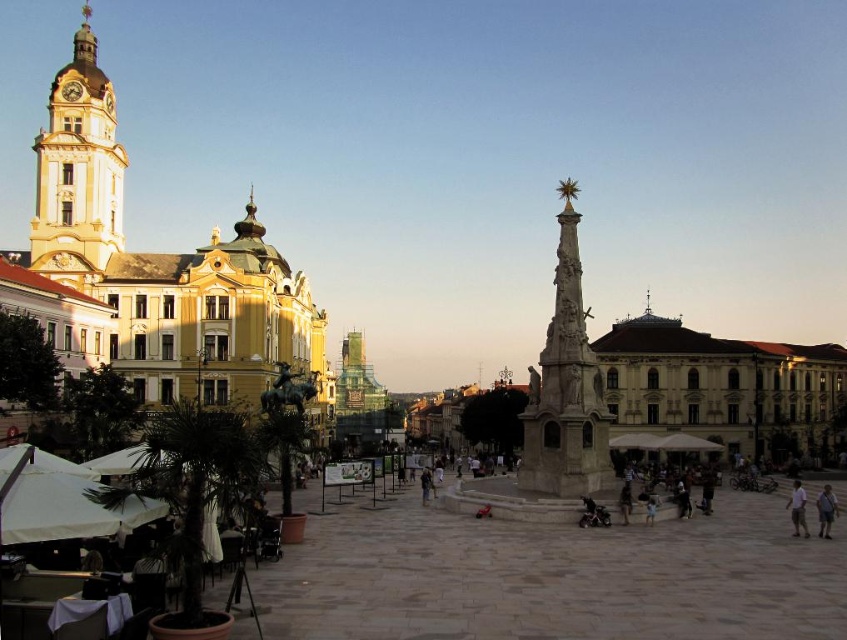
Question: Which object appears farthest from the camera in this image?

Choices:
 (A) polished stone monument at center
 (B) light pink cotton shirt at lower right
 (C) light blue shirt at center
 (D) gold/yellow stone clock tower at upper left

Answer: (D)

Question: Does gold/yellow stone clock tower at upper left have a greater width compared to light blue shirt at center?

Choices:
 (A) yes
 (B) no

Answer: (B)

Question: Can you confirm if polished stone monument at center is positioned below light blue shirt at center?

Choices:
 (A) yes
 (B) no

Answer: (B)

Question: Which of the following is the farthest from the observer?

Choices:
 (A) (822, 515)
 (B) (545, 452)

Answer: (B)

Question: Can you confirm if polished stone monument at center is wider than light pink cotton shirt at lower right?

Choices:
 (A) no
 (B) yes

Answer: (A)

Question: Which object appears closest to the camera in this image?

Choices:
 (A) polished stone monument at center
 (B) gold/yellow stone clock tower at upper left

Answer: (A)